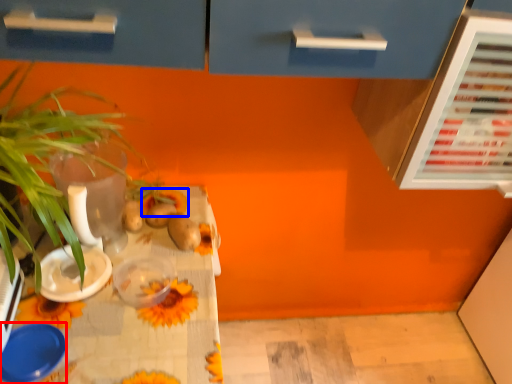
Question: Which of the following is the farthest to the observer, tableware (highlighted by a red box) or flower (highlighted by a blue box)?

Choices:
 (A) tableware
 (B) flower

Answer: (B)